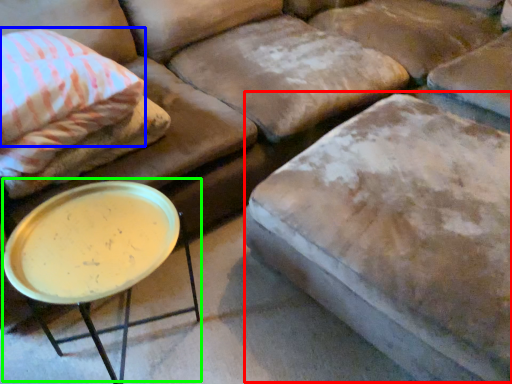
Question: Estimate the real-world distances between objects in this image. Which object is farther from swivel chair (highlighted by a red box), pillow (highlighted by a blue box) or round table (highlighted by a green box)?

Choices:
 (A) pillow
 (B) round table

Answer: (A)